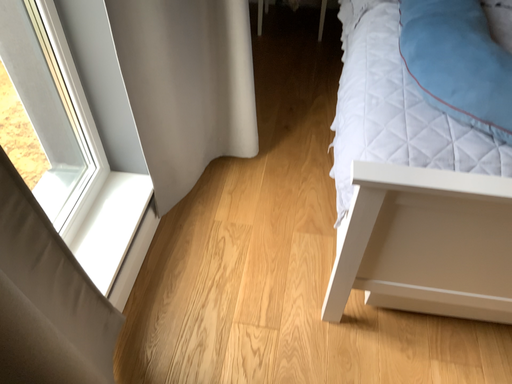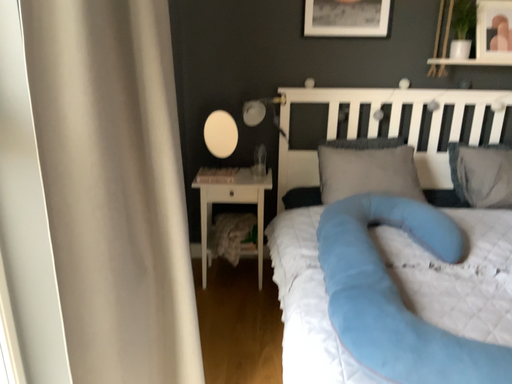
Question: How did the camera likely rotate when shooting the video?

Choices:
 (A) rotated upward
 (B) rotated downward

Answer: (A)